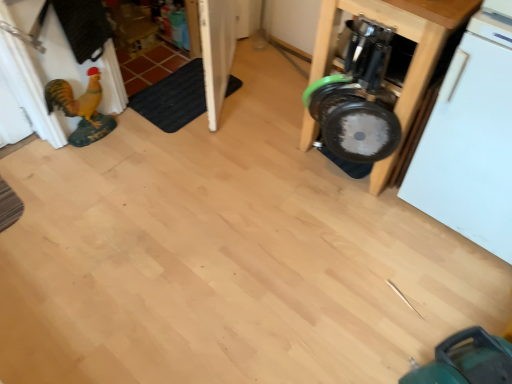
Question: Is metallic silver dumbbell at right inside the boundaries of white matte dishwasher at right, or outside?

Choices:
 (A) outside
 (B) inside

Answer: (A)

Question: From their relative heights in the image, would you say metallic silver dumbbell at right is taller or shorter than white matte dishwasher at right?

Choices:
 (A) short
 (B) tall

Answer: (A)

Question: Estimate the real-world distances between objects in this image. Which object is farther from the black rubber mat at lower left?

Choices:
 (A) metallic silver dumbbell at right
 (B) white matte dishwasher at right

Answer: (B)

Question: Estimate the real-world distances between objects in this image. Which object is farther from the white matte dishwasher at right?

Choices:
 (A) black rubber mat at lower left
 (B) metallic silver dumbbell at right

Answer: (A)